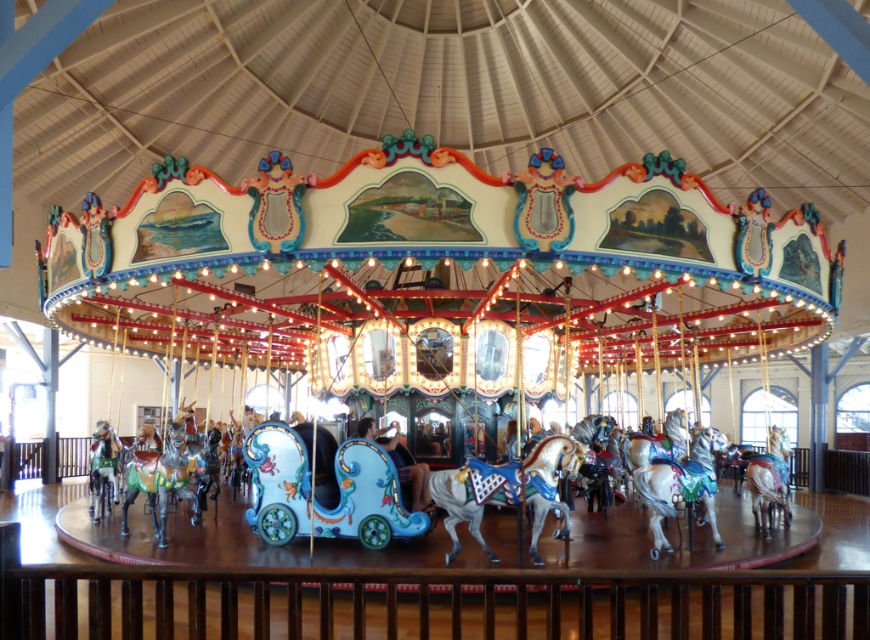
Question: Which of the following is the farthest from the observer?

Choices:
 (A) shiny white horse at center
 (B) shiny silver horse at center
 (C) shiny silver horse at lower left

Answer: (C)

Question: Can you confirm if shiny silver horse at center is smaller than shiny silver horse at lower left?

Choices:
 (A) no
 (B) yes

Answer: (A)

Question: Is shiny white horse at center above shiny silver horse at lower left?

Choices:
 (A) no
 (B) yes

Answer: (B)

Question: Which point is farther to the camera?

Choices:
 (A) shiny silver horse at lower left
 (B) shiny silver horse at center
 (C) shiny white horse at center

Answer: (A)

Question: Which object appears farthest from the camera in this image?

Choices:
 (A) shiny silver horse at center
 (B) shiny silver horse at lower left

Answer: (B)

Question: Is shiny silver horse at center to the right of shiny white horse at center from the viewer's perspective?

Choices:
 (A) yes
 (B) no

Answer: (B)